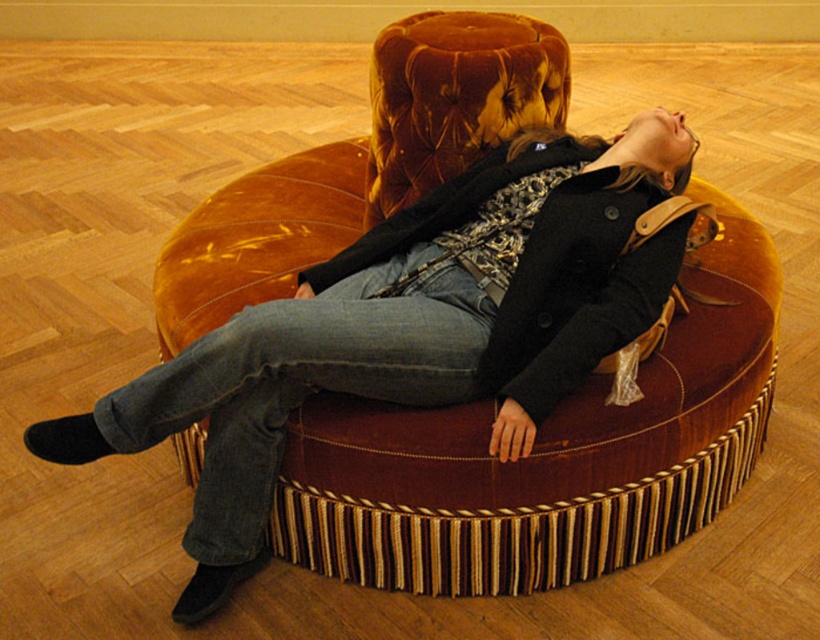
This screenshot has height=640, width=820. Identify the location of matte black coat at center. (413, 326).

Between matte black coat at center and denim at center, which one is positioned lower?

denim at center is below.

Which is behind, point (629, 140) or point (461, 372)?

Point (629, 140)

The width and height of the screenshot is (820, 640). What are the coordinates of `matte black coat at center` in the screenshot? It's located at (413, 326).